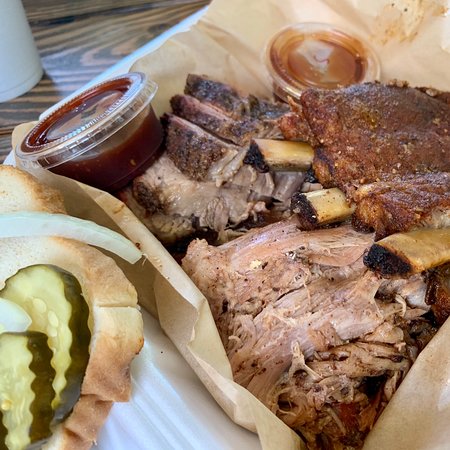
Where is `table`? The height and width of the screenshot is (450, 450). table is located at coordinates (88, 53).